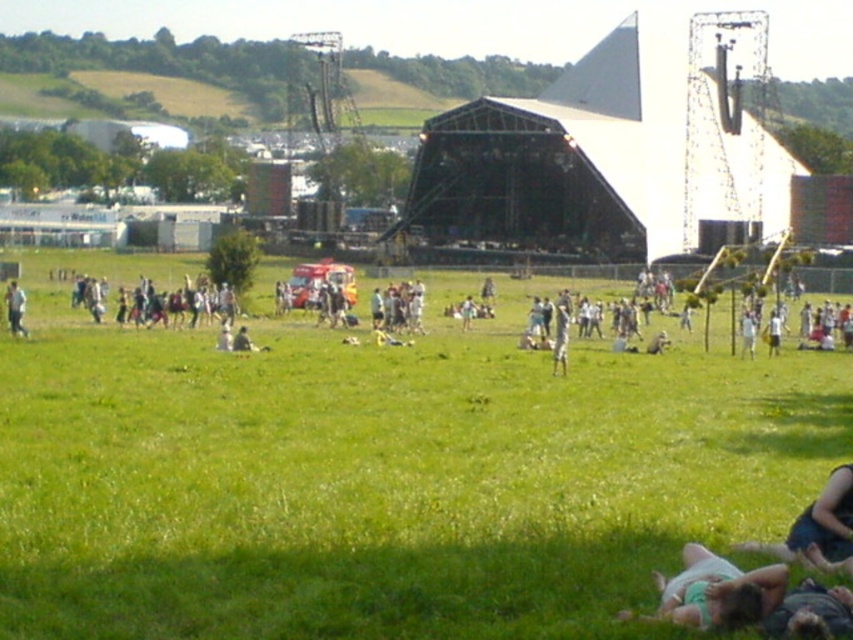
Does green grassy field at center have a smaller size compared to white fabric person at center?

No, green grassy field at center is not smaller than white fabric person at center.

Between green grassy field at center and white fabric person at center, which one has more height?

With more height is green grassy field at center.

Between point (262, 497) and point (556, 369), which one is positioned behind?

The point (556, 369) is behind.

What are the coordinates of `green grassy field at center` in the screenshot? It's located at (384, 481).

Between green grassy field at center and green fabric person at lower right, which one appears on the right side from the viewer's perspective?

Positioned to the right is green fabric person at lower right.

What do you see at coordinates (384, 481) in the screenshot?
I see `green grassy field at center` at bounding box center [384, 481].

Locate an element on the screen. This screenshot has height=640, width=853. green grassy field at center is located at coordinates (384, 481).

Does white cotton shirt at center have a smaller size compared to light brown fabric pants at lower left?

Incorrect, white cotton shirt at center is not smaller in size than light brown fabric pants at lower left.

Who is more forward, (363, 305) or (25, 298)?

Point (25, 298)

I want to click on white cotton shirt at center, so click(x=91, y=275).